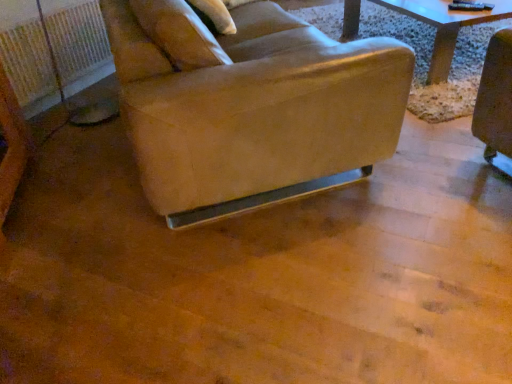
Question: Is leather-like beige chair at center at the left side of beige fabric pillow at upper center?

Choices:
 (A) no
 (B) yes

Answer: (A)

Question: From the image's perspective, is leather-like beige chair at center over beige fabric pillow at upper center?

Choices:
 (A) yes
 (B) no

Answer: (B)

Question: From a real-world perspective, is leather-like beige chair at center on beige fabric pillow at upper center?

Choices:
 (A) yes
 (B) no

Answer: (B)

Question: Is leather-like beige chair at center behind beige fabric pillow at upper center?

Choices:
 (A) yes
 (B) no

Answer: (B)

Question: Is leather-like beige chair at center smaller than beige fabric pillow at upper center?

Choices:
 (A) no
 (B) yes

Answer: (A)

Question: Is leather-like beige chair at center taller than beige fabric pillow at upper center?

Choices:
 (A) yes
 (B) no

Answer: (A)

Question: Could you tell me if white plastic radiator at left is turned towards beige fabric pillow at upper center?

Choices:
 (A) no
 (B) yes

Answer: (A)

Question: Are white plastic radiator at left and beige fabric pillow at upper center located far from each other?

Choices:
 (A) yes
 (B) no

Answer: (A)

Question: Is white plastic radiator at left not within beige fabric pillow at upper center?

Choices:
 (A) yes
 (B) no

Answer: (A)

Question: Can you confirm if white plastic radiator at left is shorter than beige fabric pillow at upper center?

Choices:
 (A) no
 (B) yes

Answer: (A)

Question: From a real-world perspective, is white plastic radiator at left located beneath beige fabric pillow at upper center?

Choices:
 (A) no
 (B) yes

Answer: (B)

Question: Is white plastic radiator at left surrounding beige fabric pillow at upper center?

Choices:
 (A) no
 (B) yes

Answer: (A)

Question: Is beige fabric pillow at upper center behind leather-like beige chair at center?

Choices:
 (A) no
 (B) yes

Answer: (B)